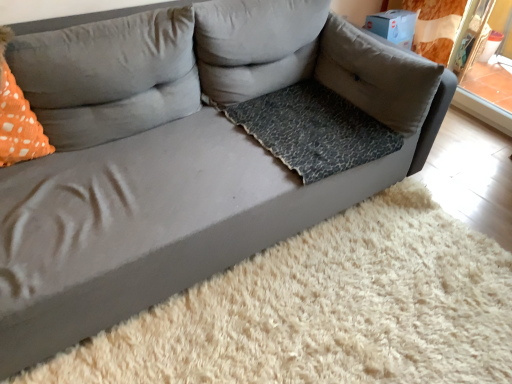
Question: Is orange dotted pillow at left, acting as the 3th pillow starting from the right, situated inside orange dotted fabric at left or outside?

Choices:
 (A) inside
 (B) outside

Answer: (B)

Question: Based on their sizes in the image, would you say orange dotted pillow at left, the first pillow from the left, is bigger or smaller than orange dotted fabric at left?

Choices:
 (A) small
 (B) big

Answer: (B)

Question: Which object is the farthest from the orange dotted pillow at left, the first pillow from the left?

Choices:
 (A) leopard print fabric dog bed at center
 (B) orange dotted fabric at left
 (C) gray fabric pillow at upper right, the third pillow viewed from the left
 (D) gray fabric pillow at center, which is the 2th pillow in left-to-right order

Answer: (C)

Question: Which object is positioned closest to the orange dotted fabric at left?

Choices:
 (A) gray fabric pillow at center, which is the second pillow in right-to-left order
 (B) orange dotted pillow at left, the first pillow from the left
 (C) leopard print fabric dog bed at center
 (D) gray fabric pillow at upper right, the third pillow viewed from the left

Answer: (B)